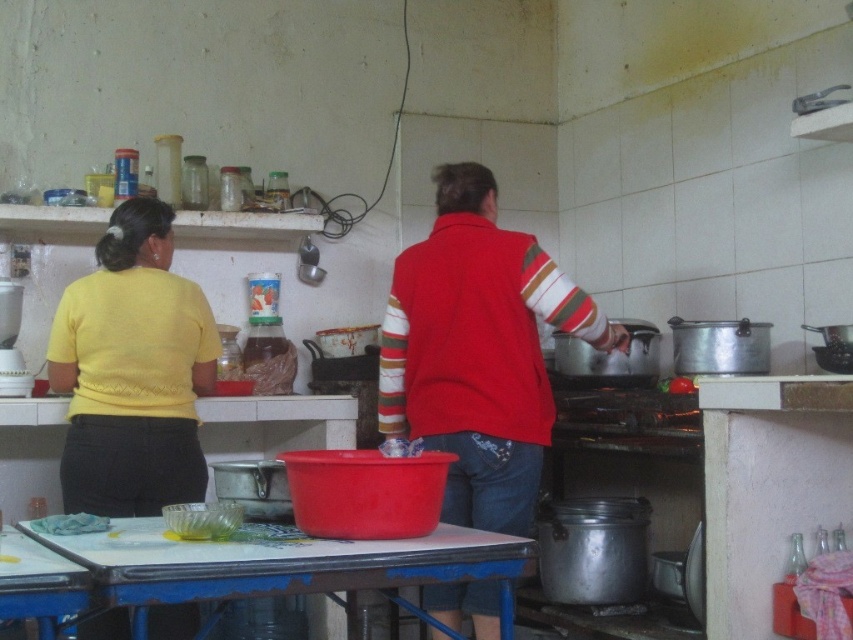
You are standing in the kitchen and need to reach both the point at coordinates (136, 372) and the point at coordinates (178, 602). Which point should you move towards first if you want to reach the one that is closer to you?

You should move towards point (178, 602) first because it is closer to you than point (136, 372), which is behind it.